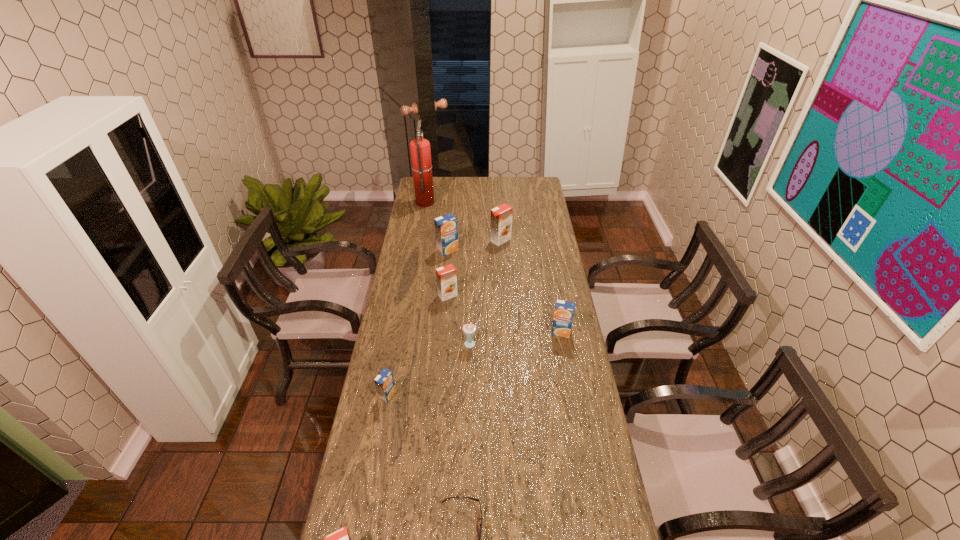
Locate an element on the screen. The height and width of the screenshot is (540, 960). free point located on the front of the leftmost blue orange_juice is located at coordinates (368, 503).

Identify the location of object at the far edge. This screenshot has height=540, width=960. (420, 150).

Locate an element on the screen. This screenshot has height=540, width=960. fire extinguisher located at the left edge is located at coordinates (420, 150).

The height and width of the screenshot is (540, 960). I want to click on orange_juice located at the left edge, so click(384, 382).

The width and height of the screenshot is (960, 540). I want to click on object at the right edge, so click(x=564, y=311).

Identify the location of object that is at the far left corner. The width and height of the screenshot is (960, 540). (420, 150).

At what (x,y) coordinates should I click in order to perform the action: click on vacant space at the far edge of the desktop. Please return your answer as a coordinate pair (x, y). This screenshot has height=540, width=960. Looking at the image, I should click on (471, 185).

Find the location of a particular element. vacant space at the left edge is located at coordinates (414, 347).

Locate an element on the screen. vacant region at the right edge of the desktop is located at coordinates (590, 395).

Locate an element on the screen. free spot at the far right corner of the desktop is located at coordinates (537, 190).